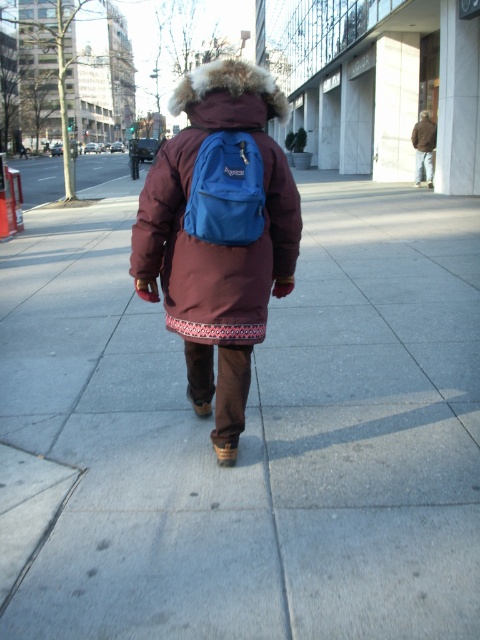
You are a delivery drone planning to land on the gray concrete sidewalk at center. You need to know if the matte blue backpack at center is too big to fit on the sidewalk. Can you determine if the backpack will fit based on their sizes?

The gray concrete sidewalk at center is wider than the matte blue backpack at center, so the backpack will fit on the sidewalk.